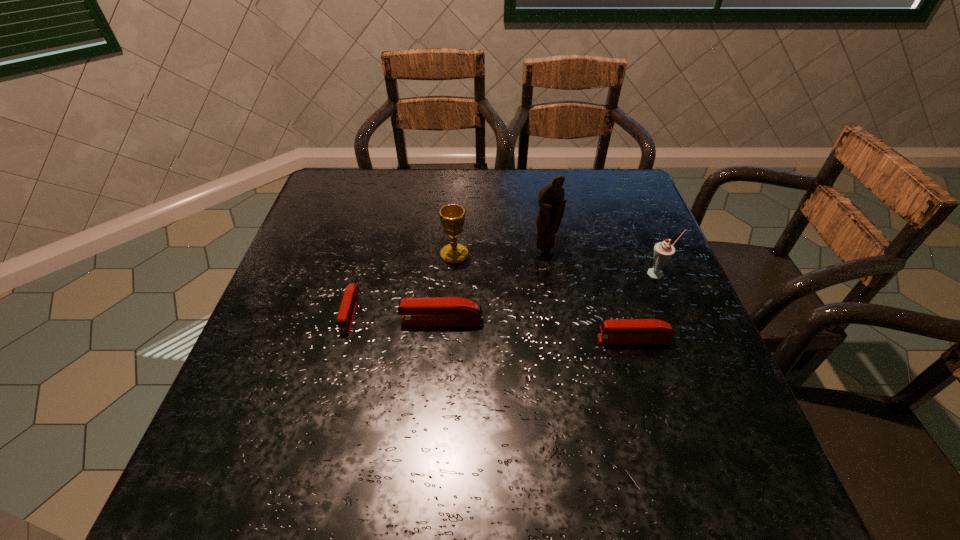
The width and height of the screenshot is (960, 540). In order to click on stapler present at the right edge in this screenshot , I will do `click(623, 331)`.

This screenshot has width=960, height=540. I want to click on milkshake situated at the right edge, so click(x=663, y=251).

Where is `free point at the far edge`? free point at the far edge is located at coordinates (488, 205).

The width and height of the screenshot is (960, 540). Find the location of `vacant space at the near edge`. vacant space at the near edge is located at coordinates coord(417,395).

Locate an element on the screen. free space at the left edge of the desktop is located at coordinates (288, 279).

I want to click on free space at the right edge of the desktop, so click(669, 374).

This screenshot has width=960, height=540. Find the location of `free space at the far left corner of the desktop`. free space at the far left corner of the desktop is located at coordinates (379, 172).

Identify the location of free space at the far right corner of the desktop. (615, 187).

Locate an element on the screen. free space at the near right corner of the desktop is located at coordinates (722, 401).

Locate an element on the screen. vacant space that's between the chalice and the second stapler from left to right is located at coordinates (448, 288).